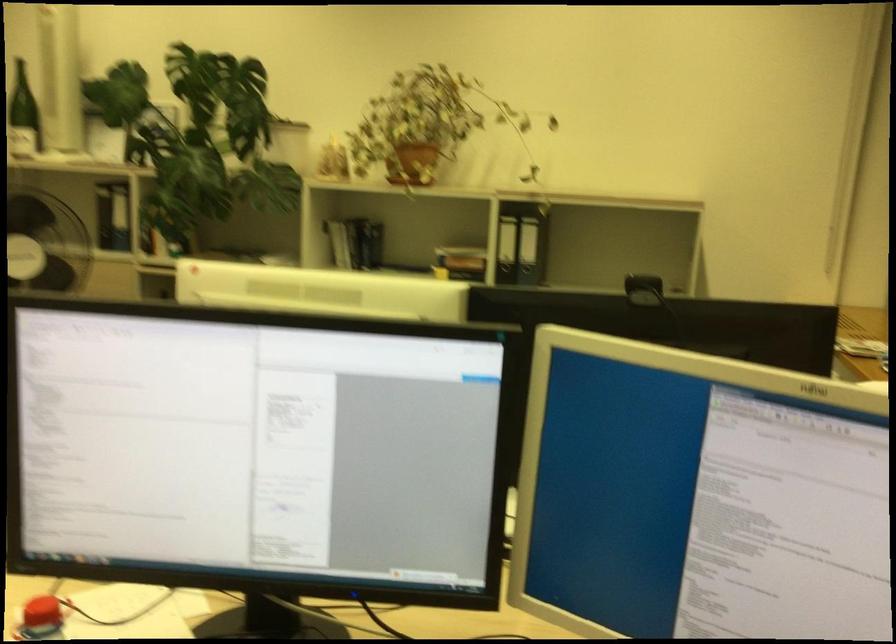
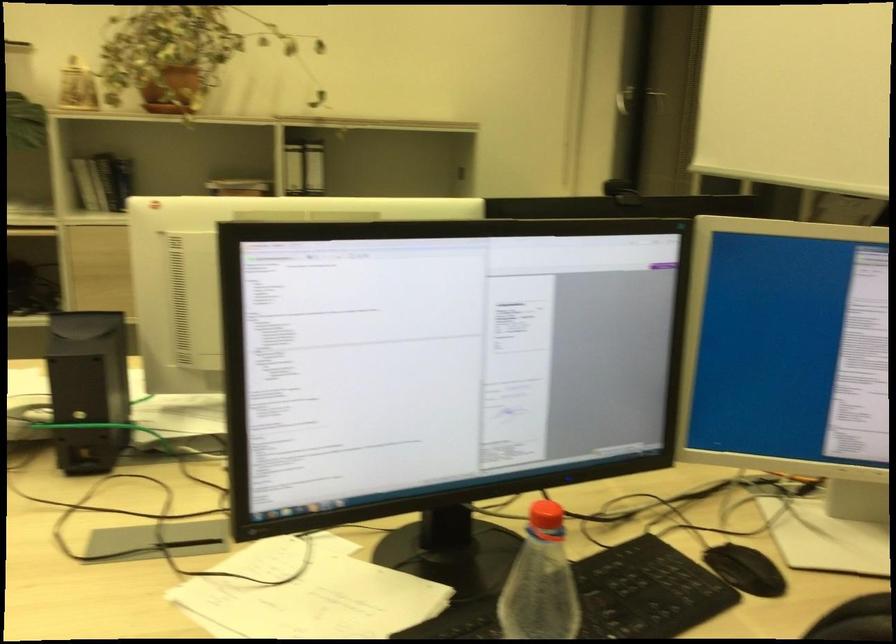
Question: The first image is from the beginning of the video and the second image is from the end. How did the camera likely rotate when shooting the video?

Choices:
 (A) Left
 (B) Right
 (C) Up
 (D) Down

Answer: (B)